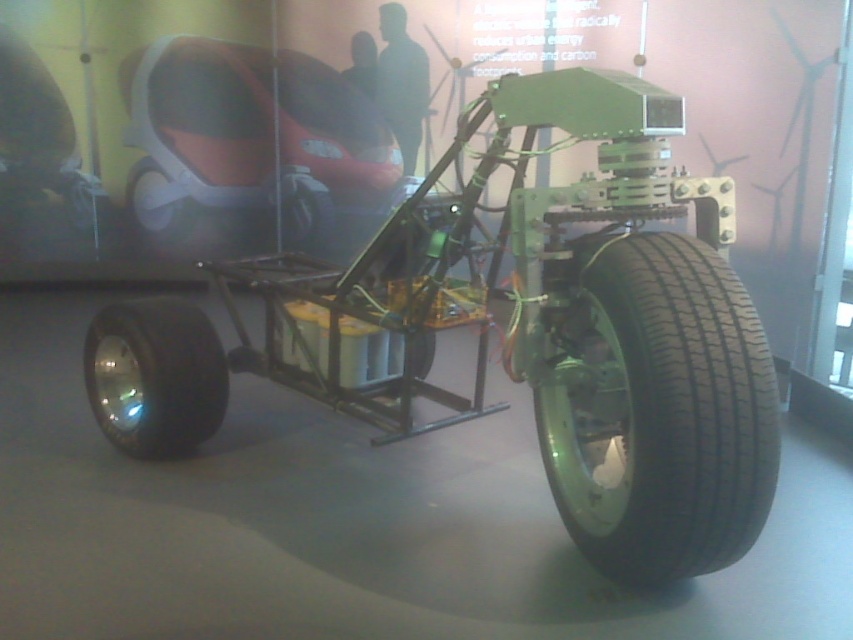
The width and height of the screenshot is (853, 640). Describe the element at coordinates (299, 209) in the screenshot. I see `black rubber wheel at center` at that location.

Between point (311, 224) and point (183, 234), which one is positioned in front?

Point (311, 224) is more forward.

The image size is (853, 640). In order to click on black rubber wheel at center in this screenshot , I will do `click(299, 209)`.

Is point (762, 436) less distant than point (281, 214)?

Yes, it is in front of point (281, 214).

Identify the location of black rubber tire at lower right. Image resolution: width=853 pixels, height=640 pixels. (660, 412).

The image size is (853, 640). What do you see at coordinates (660, 412) in the screenshot?
I see `black rubber tire at lower right` at bounding box center [660, 412].

Identify the location of black rubber tire at lower right. (660, 412).

Find the location of a particular element. The image size is (853, 640). black rubber tire at lower left is located at coordinates (154, 376).

Between black rubber tire at lower left and black rubber wheel at center, which one appears on the right side from the viewer's perspective?

black rubber wheel at center

Is point (219, 394) farther from camera compared to point (286, 232)?

No, it is not.

Identify the location of black rubber tire at lower left. The width and height of the screenshot is (853, 640). (x=154, y=376).